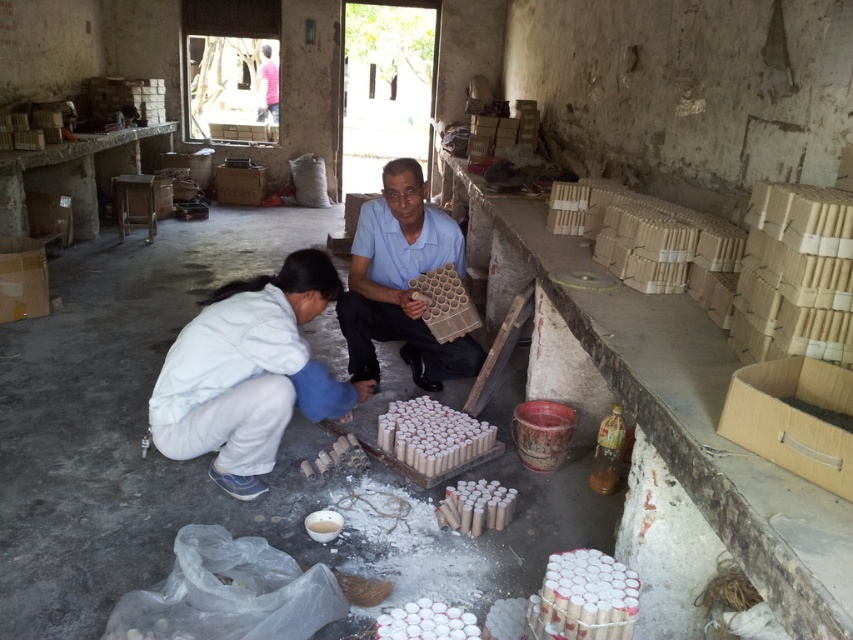
You are organizing items in the workshop and need to place the white matte cylinder at center and the white matte egg at center in a specific order. According to their positions in the image, which one should be placed to the right of the other?

The white matte cylinder at center should be placed to the right of the white matte egg at center because in the image, the white matte cylinder at center is positioned to the right of the white matte egg at center.

You are a delivery person standing at the entrance of the workshop. You need to place a new box at the position of point (390, 320) and point (463, 636). Which point is closer to the camera so that you can place the box there first?

Point (390, 320) is further to the camera than point (463, 636). Therefore, point (463, 636) is closer to the camera, so you should place the box there first.

You are a worker in the workshop and need to place the matte cardboard tray at center and the white matte egg at center into a storage container. The container can only fit items that are narrower than the container. If the container is 10 cm wide, which item can fit inside?

The white matte egg at center can fit inside the container since its width is narrower than the matte cardboard tray at center, which is wider than 10 cm.